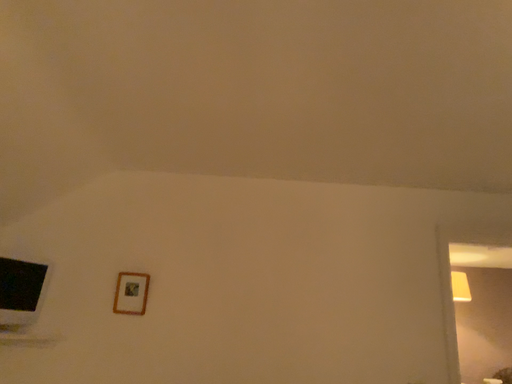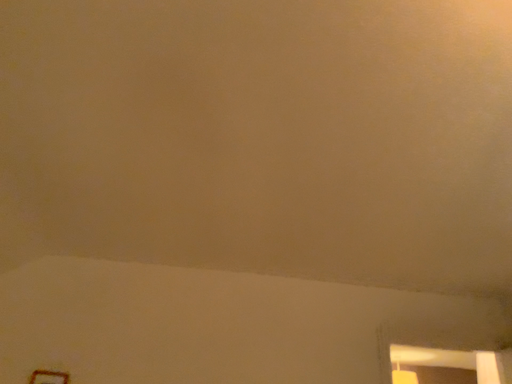
Question: Which way did the camera rotate in the video?

Choices:
 (A) rotated downward
 (B) rotated upward

Answer: (B)